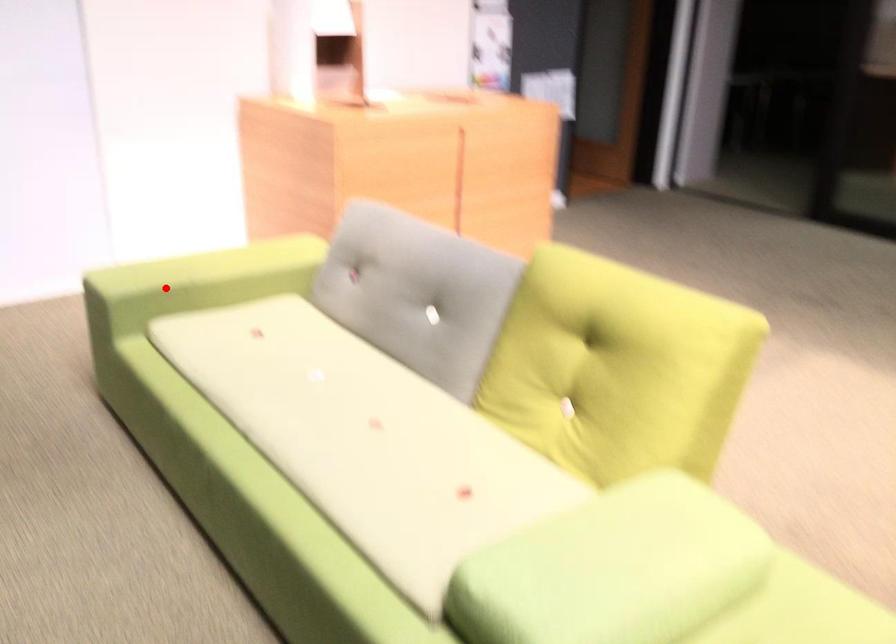
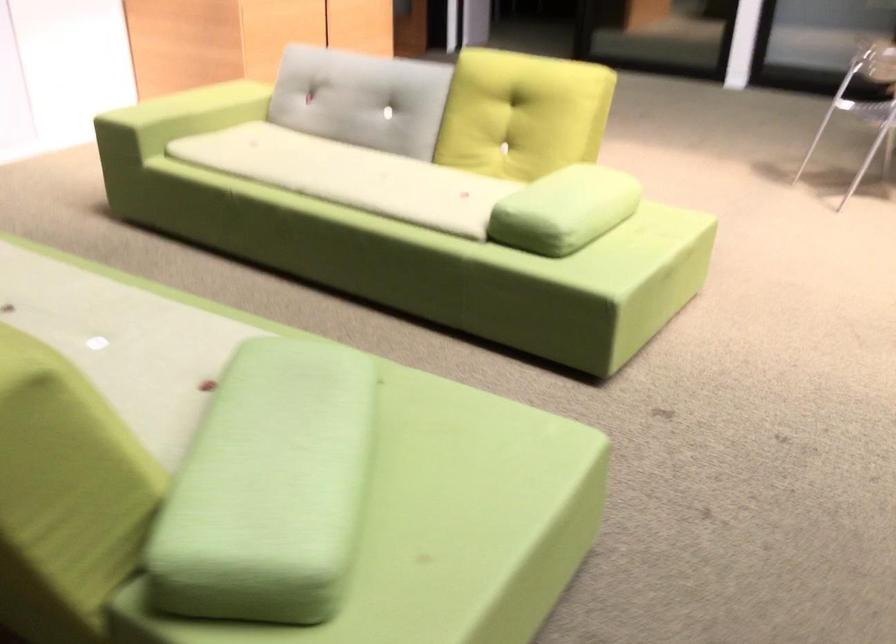
Question: I am providing you with two images of the same scene from different viewpoints. Given a red point in image1, look at the same physical point in image2. Is it:

Choices:
 (A) Closer to the viewpoint
 (B) Farther from the viewpoint

Answer: (B)